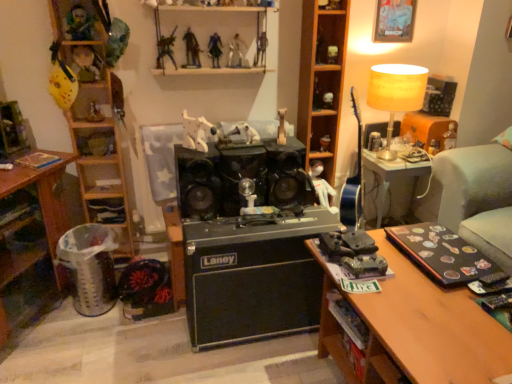
Question: Does point (436, 150) appear closer or farther from the camera than point (110, 211)?

Choices:
 (A) farther
 (B) closer

Answer: (A)

Question: From a real-world perspective, is metallic silver toy at right, which is counted as the 1th toy, starting from the right, above or below wooden shelf at left, the third shelf from the right?

Choices:
 (A) above
 (B) below

Answer: (B)

Question: Which object is positioned closest to the matte plastic figurine at upper left, acting as the fourteenth toy starting from the right?

Choices:
 (A) yellow fabric lampshade at upper right
 (B) white matte figurine at upper center, the second toy in the right-to-left sequence
 (C) wooden shelf at lower left, which is the 2th shelf in left-to-right order
 (D) wooden figurine at left, the fifteenth toy when ordered from right to left
 (E) green plastic toy at upper left, the third toy viewed from the left

Answer: (E)

Question: Which object is positioned closest to the white matte shelf at upper center, which ranks as the 4th shelf in left-to-right order?

Choices:
 (A) metallic figure at upper center, the 11th toy viewed from the right
 (B) green matte toy tank at center, the fifth toy when ordered from right to left
 (C) wooden shelf at center, which ranks as the 5th shelf in left-to-right order
 (D) metallic silver toy at right, which is counted as the 1th toy, starting from the right
 (E) wooden shelf at left, the third shelf from the right

Answer: (A)